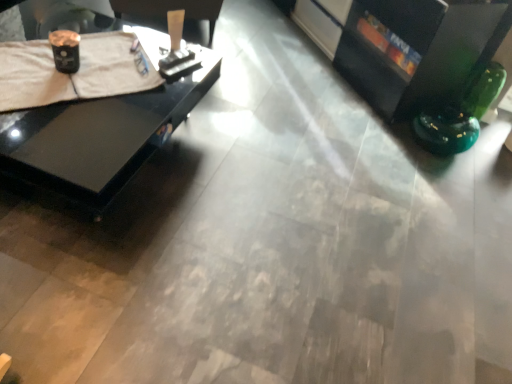
Question: Is point (13, 87) closer or farther from the camera than point (465, 3)?

Choices:
 (A) farther
 (B) closer

Answer: (B)

Question: In the image, is white cloth at upper left positioned in front of or behind black glossy entertainment center at upper right?

Choices:
 (A) front
 (B) behind

Answer: (A)

Question: Considering the real-world distances, which object is closest to the black glossy entertainment center at upper right?

Choices:
 (A) white cloth at upper left
 (B) black glossy table at left

Answer: (B)

Question: Which of these objects is positioned closest to the black glossy entertainment center at upper right?

Choices:
 (A) black glossy table at left
 (B) white cloth at upper left

Answer: (A)